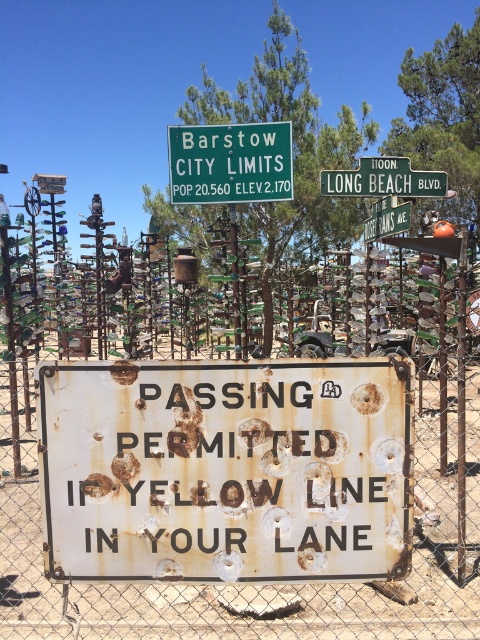
Between rusty metal fence at center and green metal sign at upper center, which one is positioned higher?

Positioned higher is green metal sign at upper center.

Does rusty metal fence at center appear on the right side of green metal sign at upper center?

No, rusty metal fence at center is not to the right of green metal sign at upper center.

Which is in front, point (134, 419) or point (268, 154)?

Point (134, 419)

This screenshot has height=640, width=480. What are the coordinates of `rusty metal fence at center` in the screenshot? It's located at (240, 499).

Is point (427, 189) closer to camera compared to point (396, 228)?

No, it is behind (396, 228).

Which is below, green metallic street sign at upper center or green plastic street sign at upper center?

green plastic street sign at upper center

Which is behind, point (408, 189) or point (375, 205)?

Positioned behind is point (375, 205).

Where is `green metallic street sign at upper center`? The width and height of the screenshot is (480, 640). green metallic street sign at upper center is located at coordinates (383, 179).

Does rusty metal fence at center come behind green metallic street sign at upper center?

No, rusty metal fence at center is in front of green metallic street sign at upper center.

Between point (164, 612) and point (394, 195), which one is positioned behind?

Point (394, 195)

Where is `rusty metal fence at center`? rusty metal fence at center is located at coordinates (240, 499).